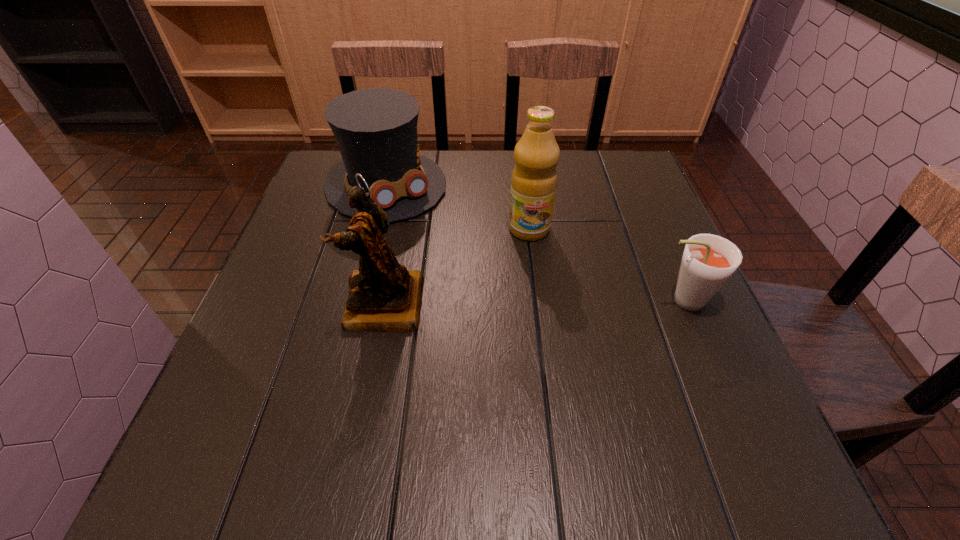
Where is `free space on the desktop that is between the figurine and the root beer and is positioned on the label of the olive oil`? The height and width of the screenshot is (540, 960). free space on the desktop that is between the figurine and the root beer and is positioned on the label of the olive oil is located at coordinates (543, 302).

Identify the location of free space on the desktop that is between the figurine and the shortest object and is positioned with goggles on the front of the second shortest object. (491, 303).